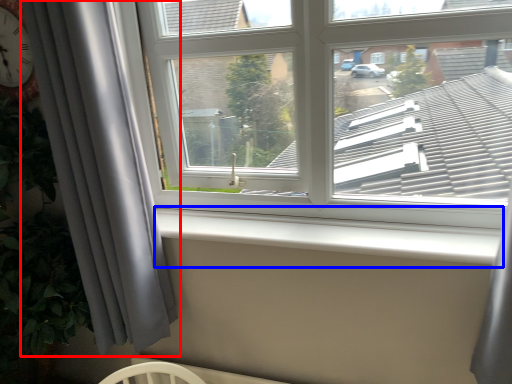
Question: Which of the following is the closest to the observer, curtain (highlighted by a red box) or window sill (highlighted by a blue box)?

Choices:
 (A) curtain
 (B) window sill

Answer: (A)